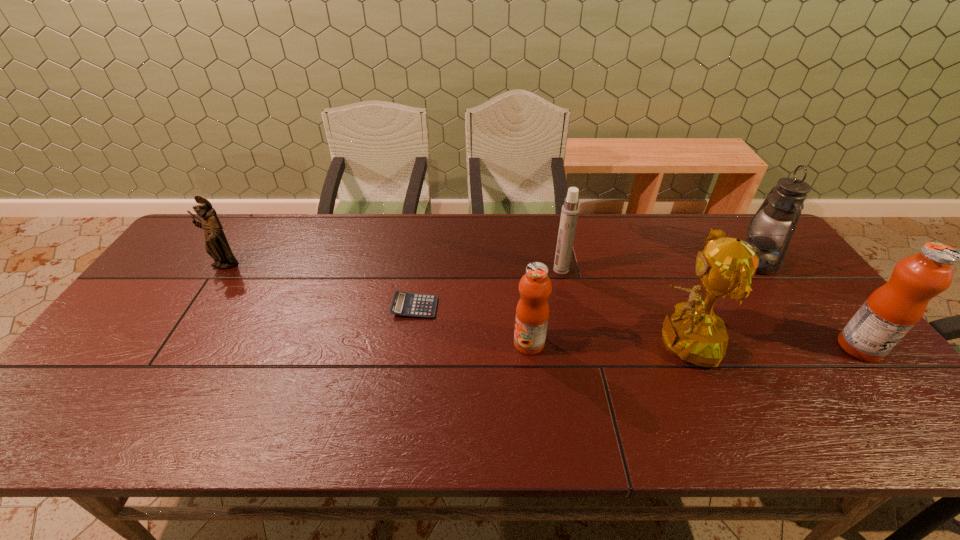
This screenshot has width=960, height=540. In order to click on free location that satisfies the following two spatial constraints: 1. on the back side of the oil lamp; 2. on the right side of the fourth object from left to right in this screenshot , I will do `click(560, 261)`.